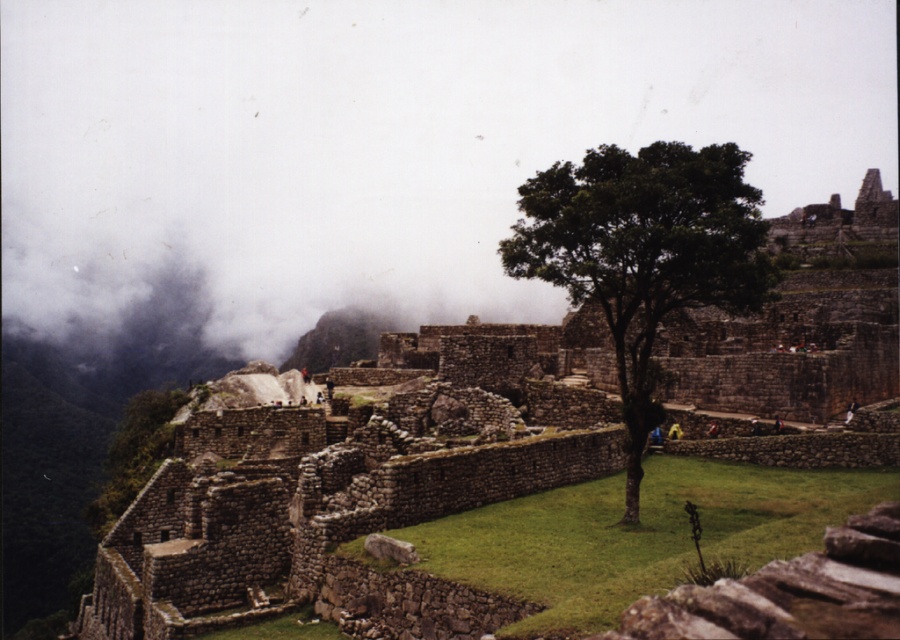
Does brown stone ruins at center come behind green leafy tree at center?

No, brown stone ruins at center is closer to the viewer.

Locate an element on the screen. brown stone ruins at center is located at coordinates (x=360, y=483).

The image size is (900, 640). In order to click on brown stone ruins at center in this screenshot , I will do `click(360, 483)`.

Between gray fog at upper left and green leafy tree at center, which one has less height?

green leafy tree at center

Which is behind, point (55, 115) or point (752, 244)?

The point (55, 115) is behind.

The image size is (900, 640). What do you see at coordinates (382, 144) in the screenshot? I see `gray fog at upper left` at bounding box center [382, 144].

Locate an element on the screen. gray fog at upper left is located at coordinates (382, 144).

Is gray fog at upper left to the right of brown stone ruins at center from the viewer's perspective?

Incorrect, gray fog at upper left is not on the right side of brown stone ruins at center.

Who is more distant from viewer, (40, 248) or (896, 346)?

Point (40, 248)

Describe the element at coordinates (382, 144) in the screenshot. I see `gray fog at upper left` at that location.

Locate an element on the screen. This screenshot has height=640, width=900. gray fog at upper left is located at coordinates (382, 144).